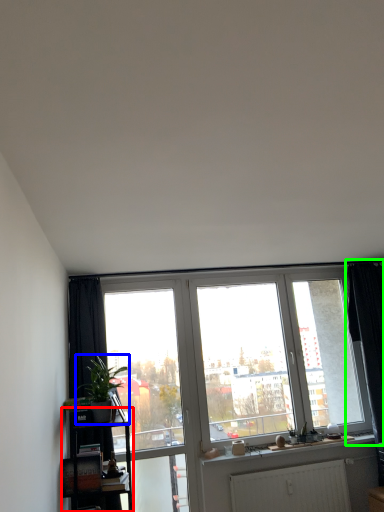
Question: Based on their relative distances, which object is farther from shelf (highlighted by a red box)? Choose from houseplant (highlighted by a blue box) and curtain (highlighted by a green box).

Choices:
 (A) houseplant
 (B) curtain

Answer: (B)